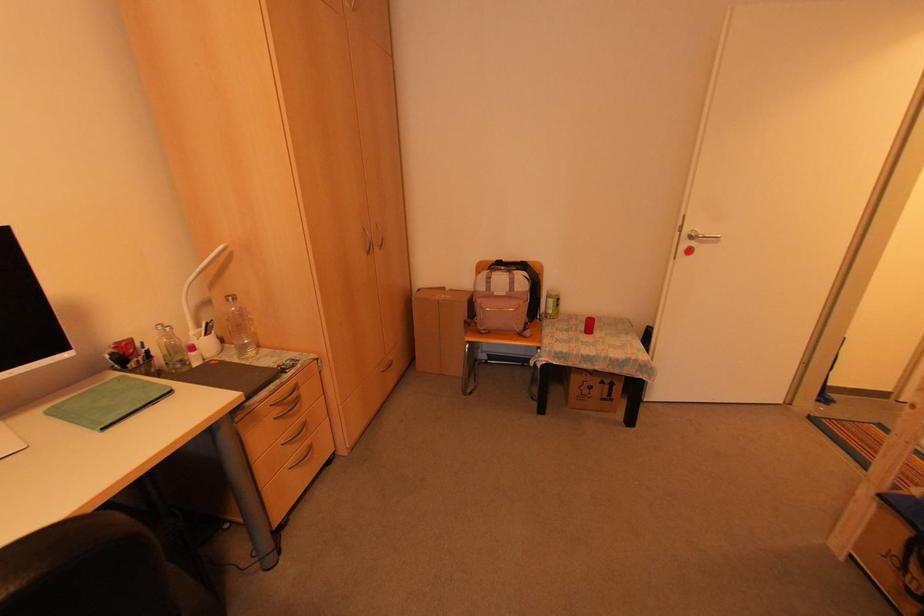
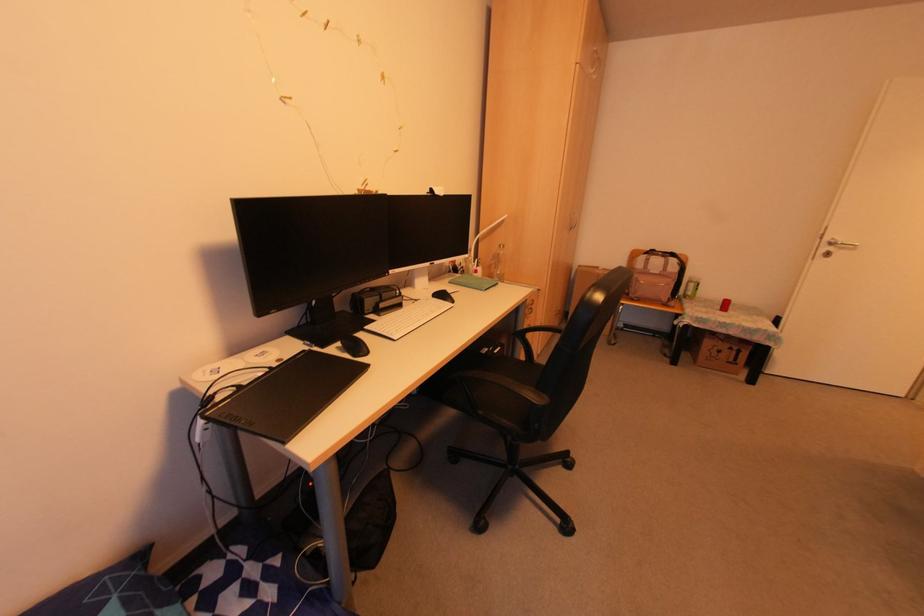
In the second image, find the point that corresponds to the highlighted location in the first image.

(825, 254)